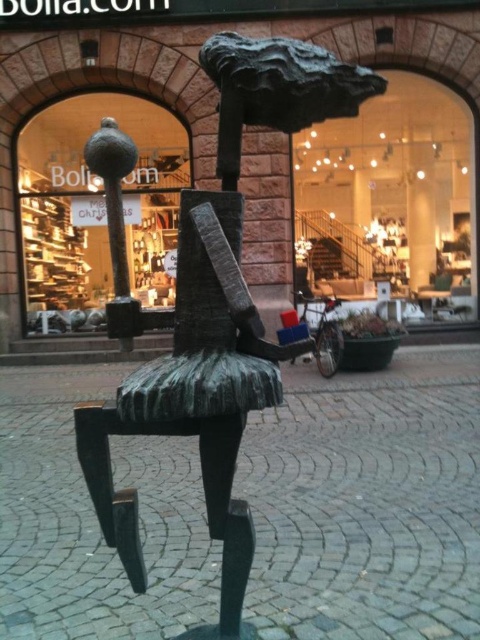
Can you confirm if matte glass vase at upper center is positioned to the left of metallic polished chair at center?

Yes, matte glass vase at upper center is to the left of metallic polished chair at center.

Can you confirm if matte glass vase at upper center is thinner than metallic polished chair at center?

Correct, matte glass vase at upper center's width is less than metallic polished chair at center's.

Does point (79, 113) come farther from viewer compared to point (434, 310)?

No, it is not.

In order to click on matte glass vase at upper center in this screenshot , I will do `click(96, 209)`.